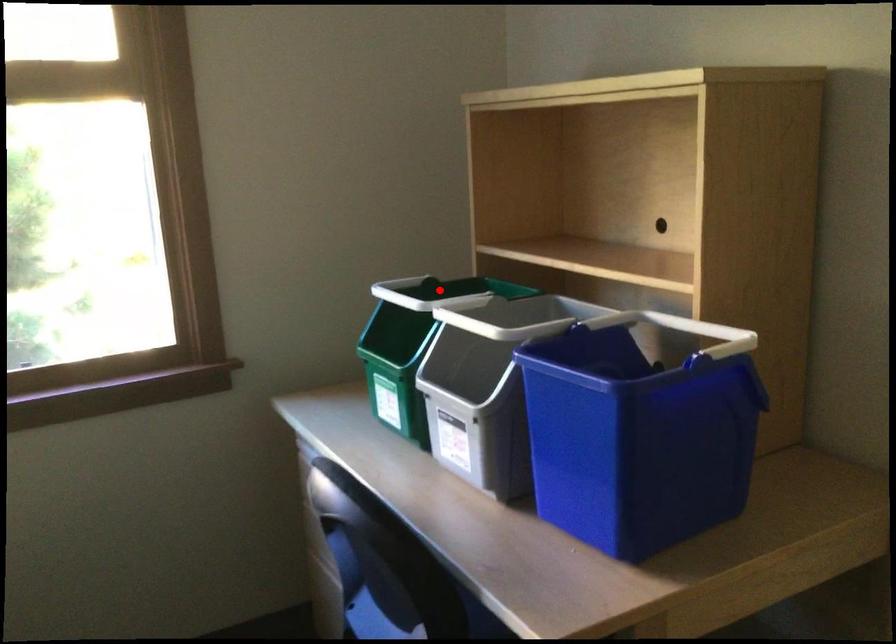
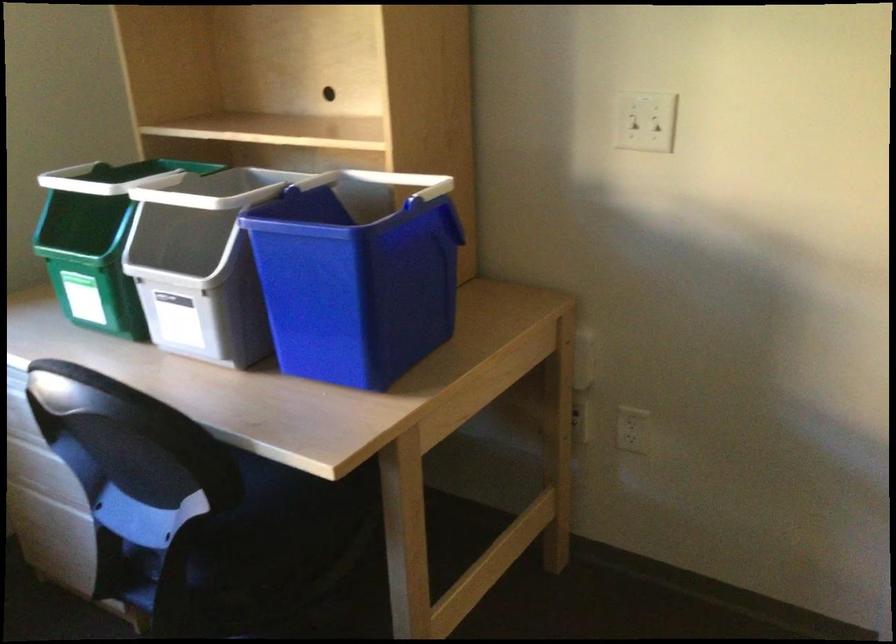
The point at the highlighted location is marked in the first image. Where is the corresponding point in the second image?

(116, 178)